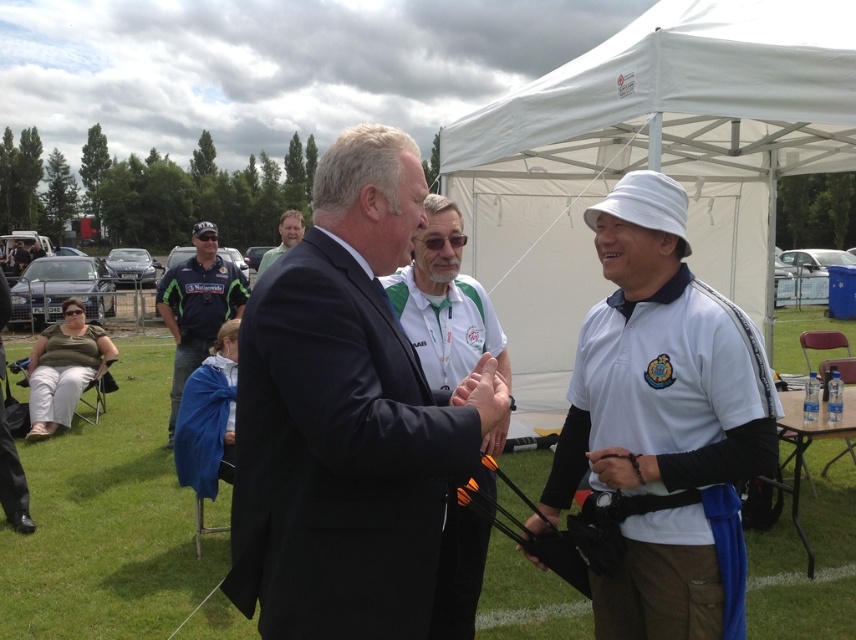
You are planning to set up a picnic blanket between the white fabric tent at upper center and the dark blue uniform at left. Based on the scene, which object should you place the blanket closer to to ensure it fits properly?

The white fabric tent at upper center might be wider than the dark blue uniform at left, so placing the picnic blanket closer to the white fabric tent at upper center would ensure it accommodates the wider space.